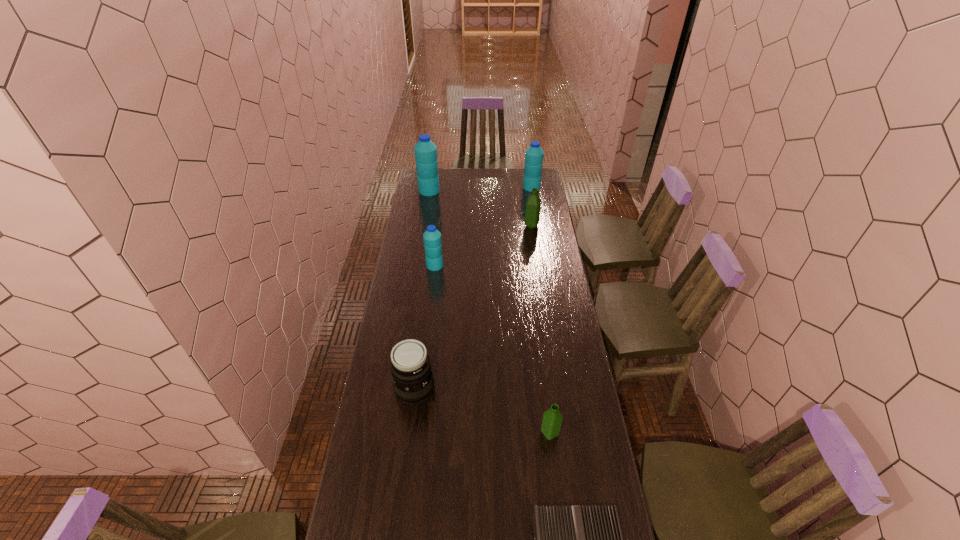
Locate an element on the screen. the nearer green water bottle is located at coordinates (552, 419).

Where is `free location located 0.280m on the right of the biggest blue water bottle`? The image size is (960, 540). free location located 0.280m on the right of the biggest blue water bottle is located at coordinates (484, 191).

You are a GUI agent. You are given a task and a screenshot of the screen. Output one action in this format:
    pyautogui.click(x=<x>, y=<y>)
    Task: Click on the free location located 0.230m on the left of the rightmost blue water bottle
    This screenshot has width=960, height=540.
    Given the screenshot: What is the action you would take?
    pyautogui.click(x=487, y=187)

This screenshot has height=540, width=960. What are the coordinates of `free space located 0.370m on the front of the third nearest water bottle` in the screenshot? It's located at (539, 275).

Image resolution: width=960 pixels, height=540 pixels. Find the location of `vacant space located 0.250m on the right of the fourth farthest object`. vacant space located 0.250m on the right of the fourth farthest object is located at coordinates (492, 265).

The width and height of the screenshot is (960, 540). Identify the location of vacant region located 0.380m on the back of the fifth farthest object. (425, 305).

I want to click on blank space located 0.300m on the back of the nearest water bottle, so click(x=540, y=358).

Find the location of a particular element. The image size is (960, 540). telephoto lens that is positioned at the left edge is located at coordinates (413, 382).

Where is `object that is at the far left corner`? The width and height of the screenshot is (960, 540). object that is at the far left corner is located at coordinates (425, 150).

Identify the location of object located in the far right corner section of the desktop. This screenshot has height=540, width=960. (534, 154).